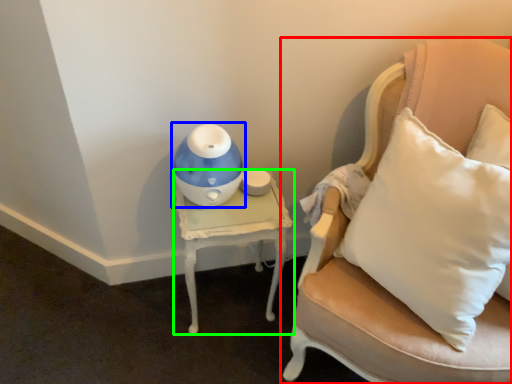
Question: Which is nearer to the chair (highlighted by a red box)? toy (highlighted by a blue box) or table (highlighted by a green box).

Choices:
 (A) toy
 (B) table

Answer: (B)